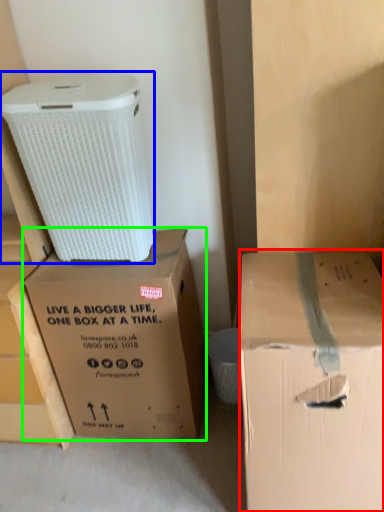
Question: Which object is positioned farthest from box (highlighted by a red box)? Select from cardboard box (highlighted by a blue box) and box (highlighted by a green box).

Choices:
 (A) cardboard box
 (B) box

Answer: (A)